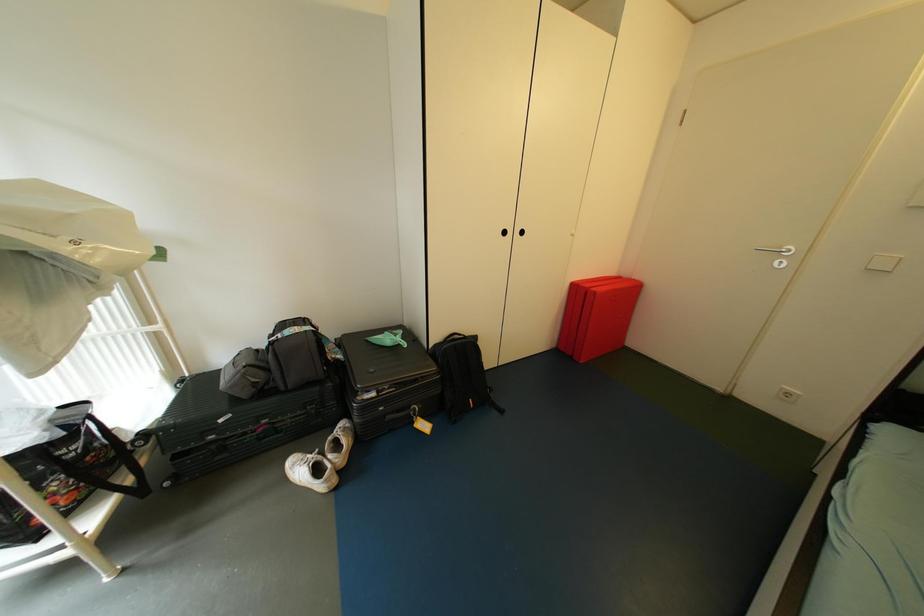
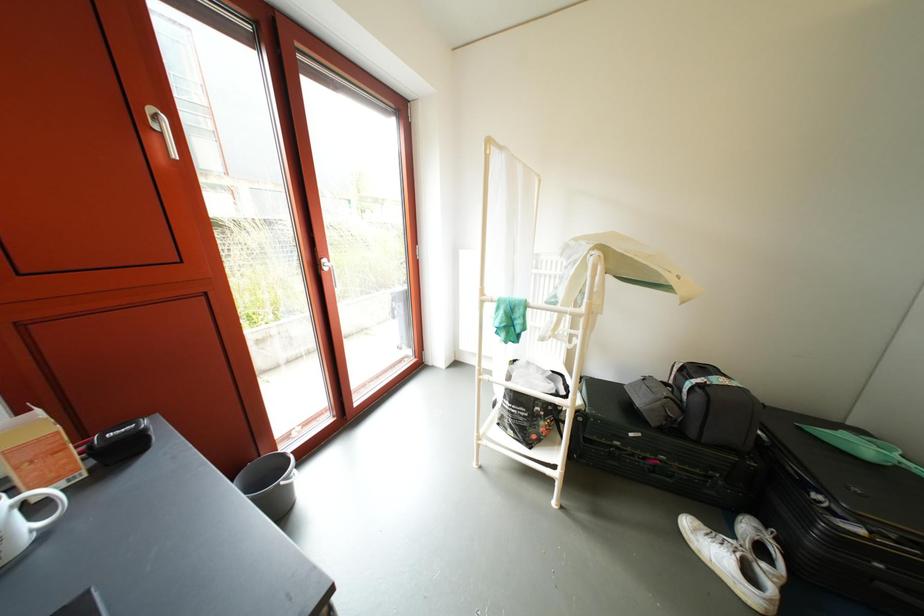
Question: How did the camera likely rotate?

Choices:
 (A) Left
 (B) Right
 (C) Up
 (D) Down

Answer: (A)